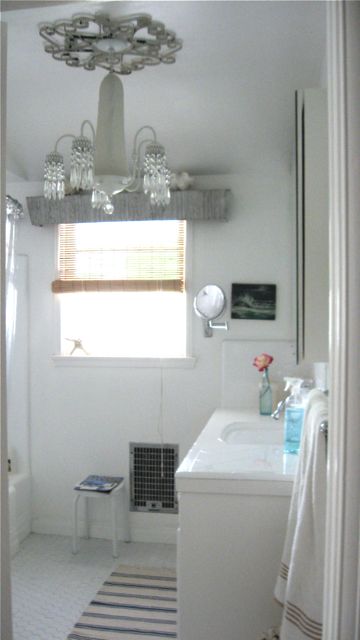
Locate an element on the screen. Image resolution: width=360 pixels, height=640 pixels. stool is located at coordinates (113, 509).